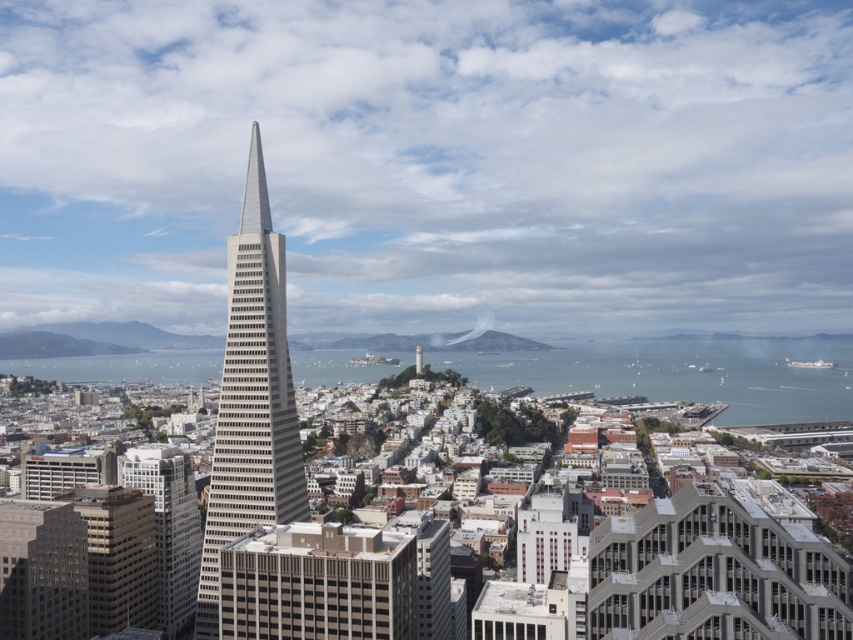
You are a delivery drone with a wingspan of 2 meters. You need to fly between the matte glass skyscraper at lower left and the matte gray building at lower left to deliver a package. Can you safely navigate the space between them?

The distance between the matte glass skyscraper at lower left and the matte gray building at lower left is 21.88 meters. Since your drone has a wingspan of 2 meters, there is more than enough space to safely navigate between them.

From the picture: You are a drone operator tasked with capturing aerial footage of the gray concrete skyscraper at center in San Francisco. To ensure the best shot, you need to position your drone directly above the skyscraper. Given the coordinates provided, what are the exact coordinates where you should position your drone?

The gray concrete skyscraper at center is located at coordinates point [251,397], so you should position your drone directly above those coordinates to capture the best shot.